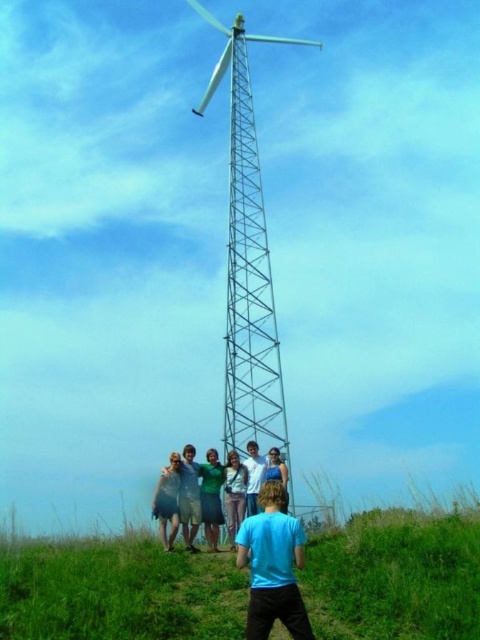
Does white shirt at center have a lesser height compared to blue denim jeans at lower center?

No.

This screenshot has width=480, height=640. Identify the location of white shirt at center. (253, 476).

Does green fabric shirt at center have a lesser height compared to white shirt at center?

No, green fabric shirt at center is not shorter than white shirt at center.

Who is higher up, green fabric shirt at center or white shirt at center?

Positioned higher is white shirt at center.

Identify the location of green fabric shirt at center. (211, 497).

Does blue t-shirt at lower center appear under light blue shirt at center?

Indeed, blue t-shirt at lower center is positioned under light blue shirt at center.

Locate an element on the screen. blue t-shirt at lower center is located at coordinates (273, 566).